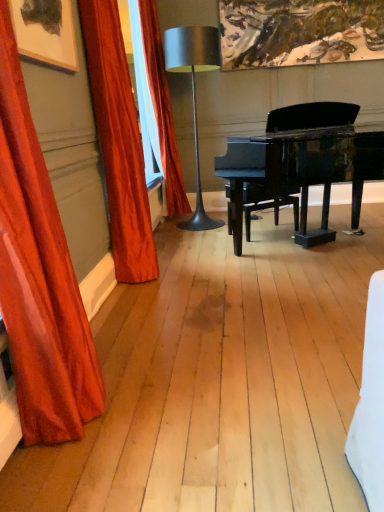
Where is `free space that is in between black polished piano at center and satin red curtain at left, the third curtain from the back`? free space that is in between black polished piano at center and satin red curtain at left, the third curtain from the back is located at coordinates (220, 318).